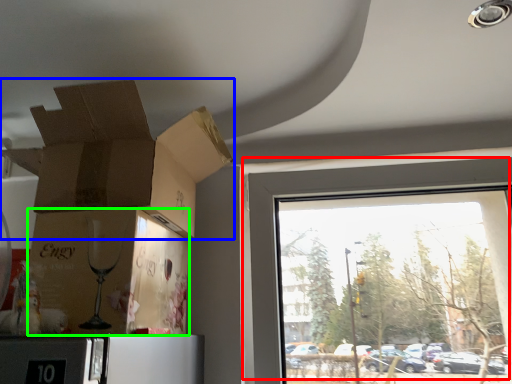
Question: Considering the real-world distances, which object is farthest from window (highlighted by a red box)? cardboard box (highlighted by a blue box) or cardboard box (highlighted by a green box)?

Choices:
 (A) cardboard box
 (B) cardboard box

Answer: (B)